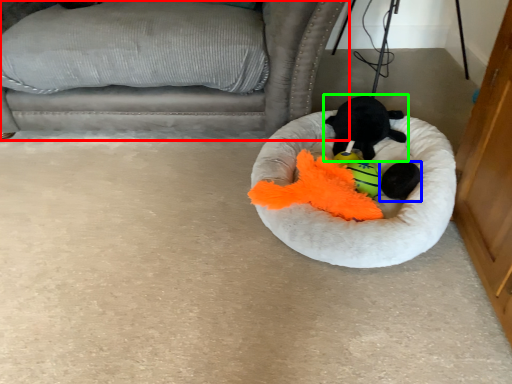
Question: Which is nearer to the furniture (highlighted by a red box)? animal (highlighted by a blue box) or toy (highlighted by a green box).

Choices:
 (A) animal
 (B) toy

Answer: (B)